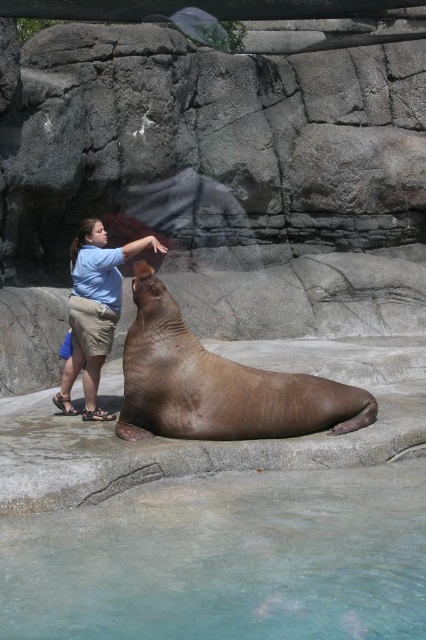
Question: Is brown smooth seal at center to the left of light blue shirt at center from the viewer's perspective?

Choices:
 (A) yes
 (B) no

Answer: (B)

Question: Can you confirm if clear glass water at lower center is bigger than light blue shirt at center?

Choices:
 (A) yes
 (B) no

Answer: (A)

Question: Does clear glass water at lower center lie in front of light blue shirt at center?

Choices:
 (A) yes
 (B) no

Answer: (A)

Question: Which object is the closest to the clear glass water at lower center?

Choices:
 (A) light blue shirt at center
 (B) brown smooth seal at center

Answer: (B)

Question: Estimate the real-world distances between objects in this image. Which object is farther from the clear glass water at lower center?

Choices:
 (A) light blue shirt at center
 (B) brown smooth seal at center

Answer: (A)

Question: Which object appears farthest from the camera in this image?

Choices:
 (A) brown smooth seal at center
 (B) clear glass water at lower center

Answer: (A)